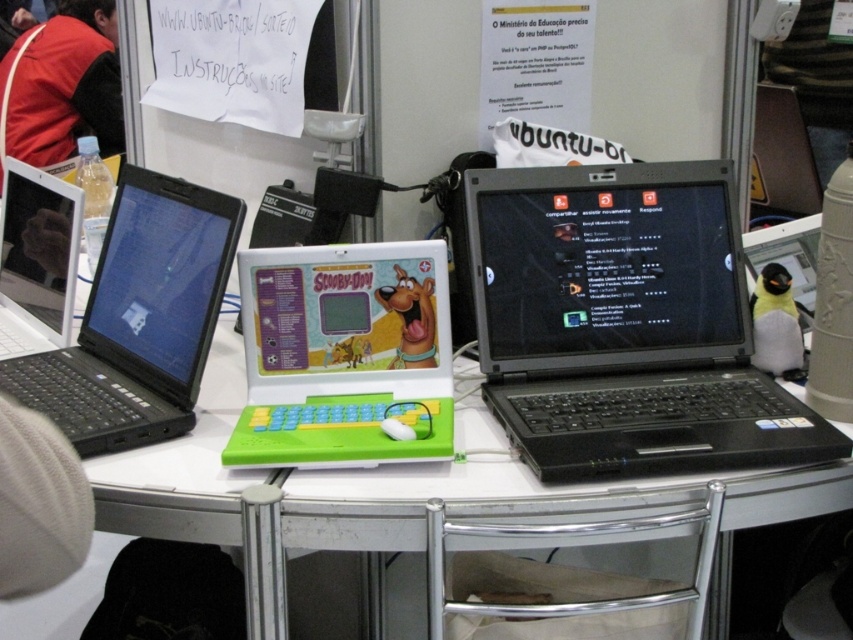
You are at a tech exhibition and see three laptops on a table. The left one is a standard black laptop, the middle one is a smaller green keyboard laptop with a cartoon design, and the right one is another standard black laptop. A point labeled at coordinates (x=625, y=324) is marked on the image. Which laptop does this point correspond to?

The point labeled at coordinates (x=625, y=324) corresponds to the black plastic laptop at center.

You are at a tech exhibition and want to take a photo of the black plastic laptop at center without the black plastic laptop at left blocking the view. Is the current arrangement allowing you to do that?

The black plastic laptop at center is in front of the black plastic laptop at left, so you can take a photo of the black plastic laptop at center without obstruction from the black plastic laptop at left.

You are setting up a tech exhibition and need to stack the black plastic laptop at center and the black plastic laptop at left vertically. Which one should you place at the bottom to ensure stability?

The black plastic laptop at center has a greater height compared to the black plastic laptop at left, so placing the taller laptop at the bottom would provide a more stable base for the stack.